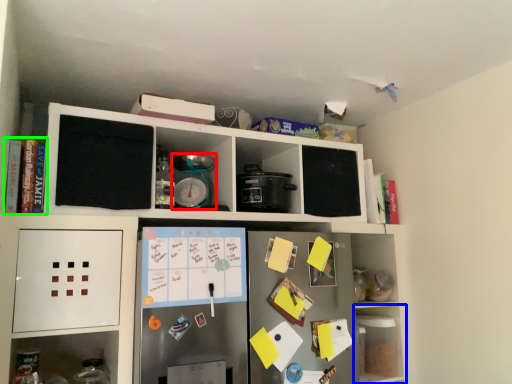
Question: Which is nearer to the appliance (highlighted by a red box)? shelf (highlighted by a blue box) or book (highlighted by a green box).

Choices:
 (A) shelf
 (B) book

Answer: (B)